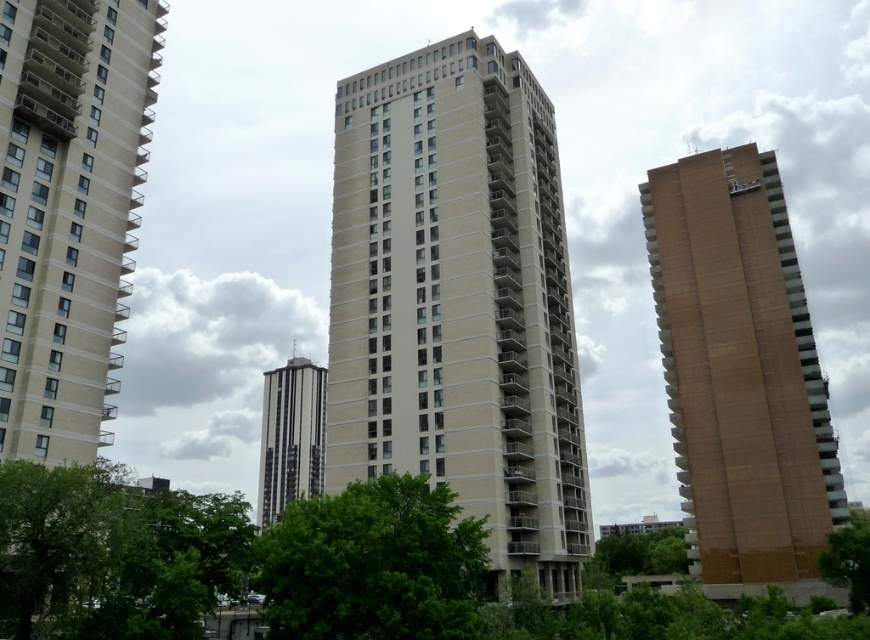
Does brown concrete building at right have a lesser height compared to green leafy tree at lower left?

Yes.

Can you confirm if brown concrete building at right is smaller than green leafy tree at lower left?

Yes, brown concrete building at right is smaller than green leafy tree at lower left.

The image size is (870, 640). Describe the element at coordinates (740, 369) in the screenshot. I see `brown concrete building at right` at that location.

The image size is (870, 640). I want to click on brown concrete building at right, so click(x=740, y=369).

Who is lower down, beige concrete building at left or green leafy tree at lower right?

green leafy tree at lower right is below.

Can you confirm if beige concrete building at left is thinner than green leafy tree at lower right?

Yes.

Is point (44, 452) positioned in front of point (864, 586)?

Yes, point (44, 452) is in front of point (864, 586).

Locate an element on the screen. beige concrete building at left is located at coordinates (x=69, y=212).

Does beige concrete building at center appear on the right side of green leafy tree at lower left?

Correct, you'll find beige concrete building at center to the right of green leafy tree at lower left.

Is point (367, 316) in front of point (188, 493)?

Yes, it is.

Which is behind, point (418, 120) or point (39, 468)?

Point (418, 120)

You are a GUI agent. You are given a task and a screenshot of the screen. Output one action in this format:
    pyautogui.click(x=<x>, y=<y>)
    Task: Click on the beige concrete building at center
    Image resolution: width=870 pixels, height=640 pixels.
    Given the screenshot: What is the action you would take?
    (458, 300)